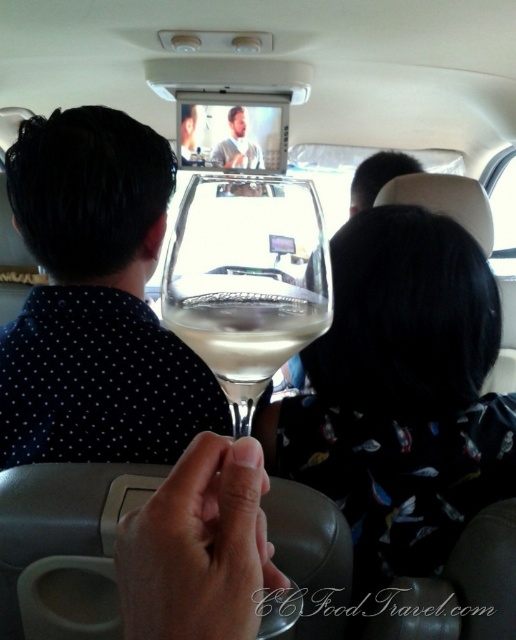
Can you confirm if silky black hair at center is shorter than black dotted shirt at upper left?

Yes, silky black hair at center is shorter than black dotted shirt at upper left.

Who is positioned more to the left, silky black hair at center or black dotted shirt at upper left?

From the viewer's perspective, black dotted shirt at upper left appears more on the left side.

You are a GUI agent. You are given a task and a screenshot of the screen. Output one action in this format:
    pyautogui.click(x=<x>, y=<y>)
    Task: Click on the silky black hair at center
    
    Given the screenshot: What is the action you would take?
    pyautogui.click(x=400, y=394)

Which of these two, black dotted shirt at upper left or smooth skin face at center, stands taller?

black dotted shirt at upper left is taller.

Between black dotted shirt at upper left and smooth skin face at center, which one is positioned lower?

black dotted shirt at upper left

Measure the distance between black dotted shirt at upper left and camera.

27.66 inches

This screenshot has height=640, width=516. In order to click on black dotted shirt at upper left in this screenshot , I will do `click(95, 300)`.

Which is more to the right, black dotted shirt at upper left or clear glass wine glass at center?

From the viewer's perspective, clear glass wine glass at center appears more on the right side.

Who is more forward, (41,456) or (215,182)?

Point (215,182) is in front.

Locate an element on the screen. The image size is (516, 640). black dotted shirt at upper left is located at coordinates (95, 300).